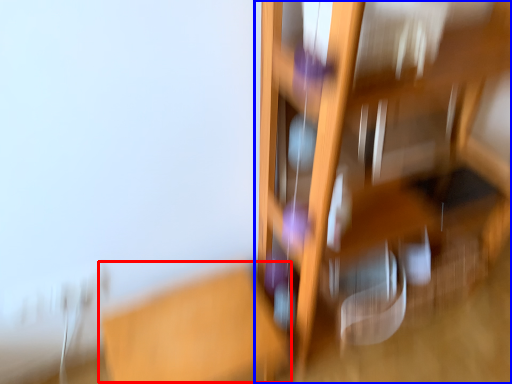
Question: Which point is closer to the camera, table (highlighted by a red box) or furniture (highlighted by a blue box)?

Choices:
 (A) table
 (B) furniture

Answer: (B)